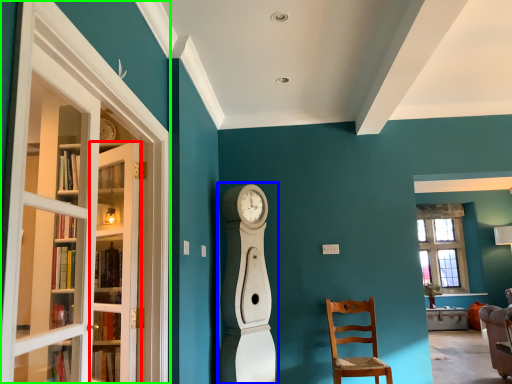
Question: Estimate the real-world distances between objects in this image. Which object is closer to door (highlighted by a red box), open (highlighted by a blue box) or screen door (highlighted by a green box)?

Choices:
 (A) open
 (B) screen door

Answer: (B)